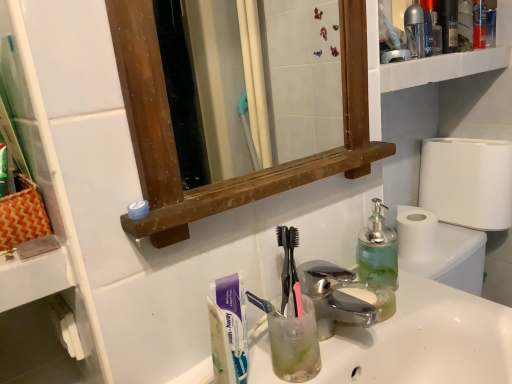
Question: Does point (30, 233) appear closer or farther from the camera than point (500, 198)?

Choices:
 (A) closer
 (B) farther

Answer: (A)

Question: From the image's perspective, is orange woven picnic basket at left positioned above or below white paper toilet roll at right?

Choices:
 (A) above
 (B) below

Answer: (B)

Question: Which object is the farthest from the white matte toothpaste at lower left?

Choices:
 (A) transparent plastic bottle at upper right, marked as the 2th bottle in a bottom-to-top arrangement
 (B) white paper toilet roll at right
 (C) orange woven picnic basket at left
 (D) green translucent soap dispenser at right, which appears as the second bottle when viewed from the back
 (E) white glossy sink at center

Answer: (B)

Question: Based on their relative distances, which object is farther from the orange woven picnic basket at left?

Choices:
 (A) white glossy sink at center
 (B) transparent plastic bottle at upper right, positioned as the 2th bottle in front-to-back order
 (C) green translucent soap dispenser at right, the second bottle viewed from the top
 (D) polished chrome faucet at center
 (E) white matte toothpaste at lower left

Answer: (B)